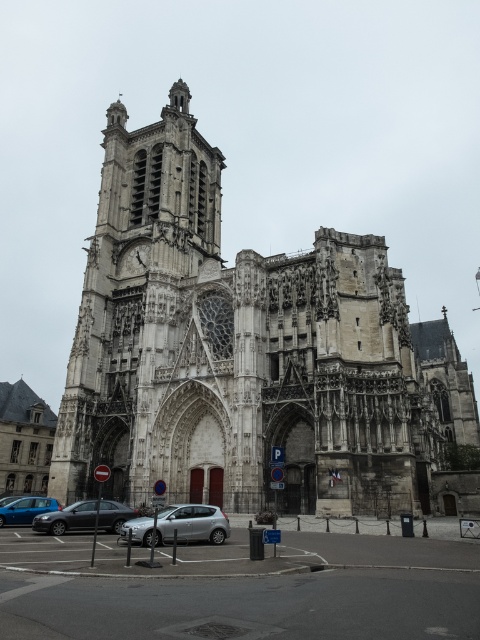
Does stone gothic church at center appear under silver metallic hatchback at lower center?

No, stone gothic church at center is not below silver metallic hatchback at lower center.

Where is `stone gothic church at center`? This screenshot has height=640, width=480. stone gothic church at center is located at coordinates (245, 352).

Consider the image. Is stone gothic church at center in front of silver metallic sedan at center?

No, it is not.

What do you see at coordinates (245, 352) in the screenshot?
I see `stone gothic church at center` at bounding box center [245, 352].

Where is `stone gothic church at center`? The width and height of the screenshot is (480, 640). stone gothic church at center is located at coordinates (245, 352).

Which is in front, point (200, 522) or point (108, 500)?

Point (200, 522) is more forward.

Is silver metallic hatchback at lower center positioned in front of silver metallic sedan at center?

Yes, silver metallic hatchback at lower center is in front of silver metallic sedan at center.

Between point (149, 536) and point (132, 513), which one is positioned in front?

Positioned in front is point (149, 536).

The height and width of the screenshot is (640, 480). In order to click on silver metallic hatchback at lower center in this screenshot , I will do `click(192, 524)`.